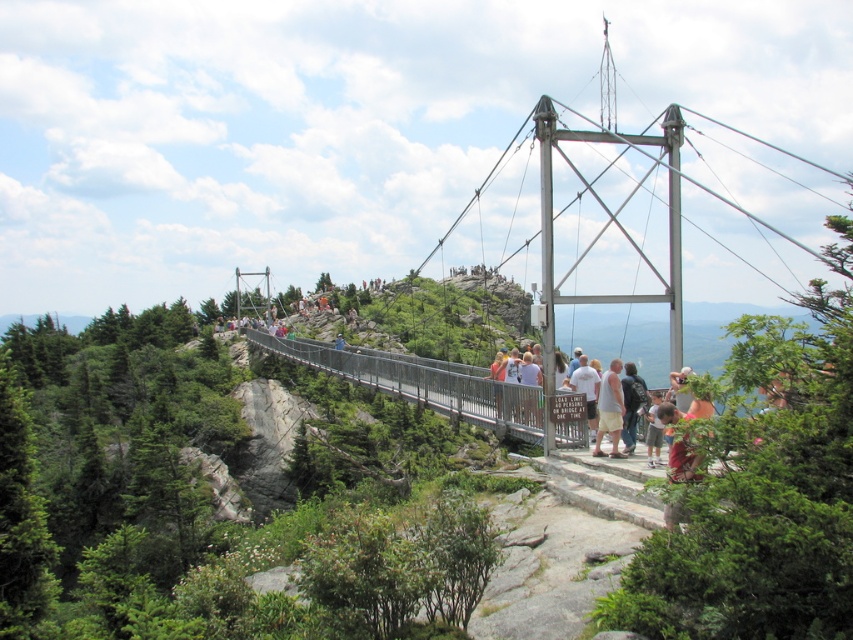
Question: Observing the image, what is the correct spatial positioning of light beige shorts at center in reference to white t-shirt at center?

Choices:
 (A) left
 (B) right

Answer: (B)

Question: Is camouflage shirt at lower right further to camera compared to white t-shirt at center?

Choices:
 (A) yes
 (B) no

Answer: (B)

Question: Which of the following is the closest to the observer?

Choices:
 (A) light beige shorts at center
 (B) camouflage shirt at lower right

Answer: (B)

Question: Which object is the farthest from the light beige shorts at center?

Choices:
 (A) camouflage shirt at lower right
 (B) white t-shirt at center

Answer: (A)

Question: Which point is closer to the camera?

Choices:
 (A) (666, 417)
 (B) (595, 404)

Answer: (A)

Question: Is light beige shorts at center positioned in front of white t-shirt at center?

Choices:
 (A) no
 (B) yes

Answer: (B)